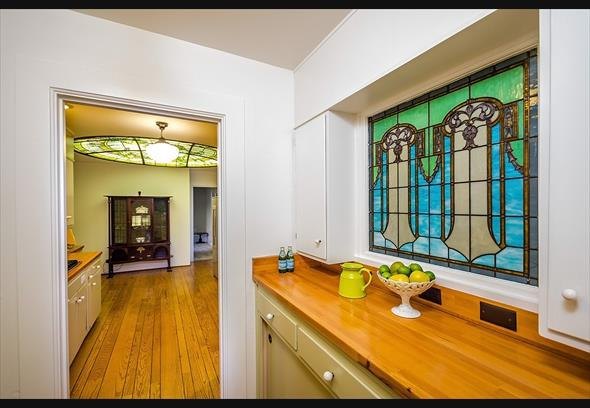
This screenshot has height=408, width=590. I want to click on pantry, so click(331, 224).